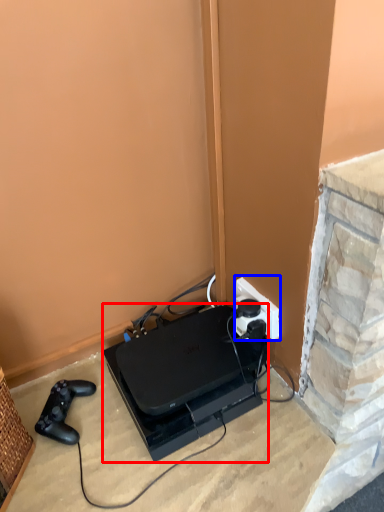
Question: Among these objects, which one is nearest to the camera, appliance (highlighted by a red box) or power plugs and sockets (highlighted by a blue box)?

Choices:
 (A) appliance
 (B) power plugs and sockets

Answer: (A)